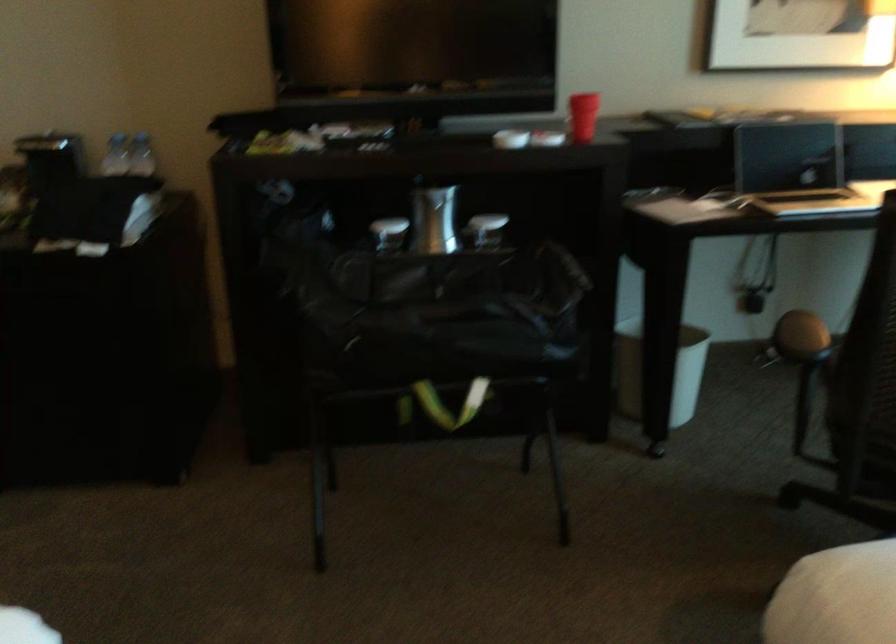
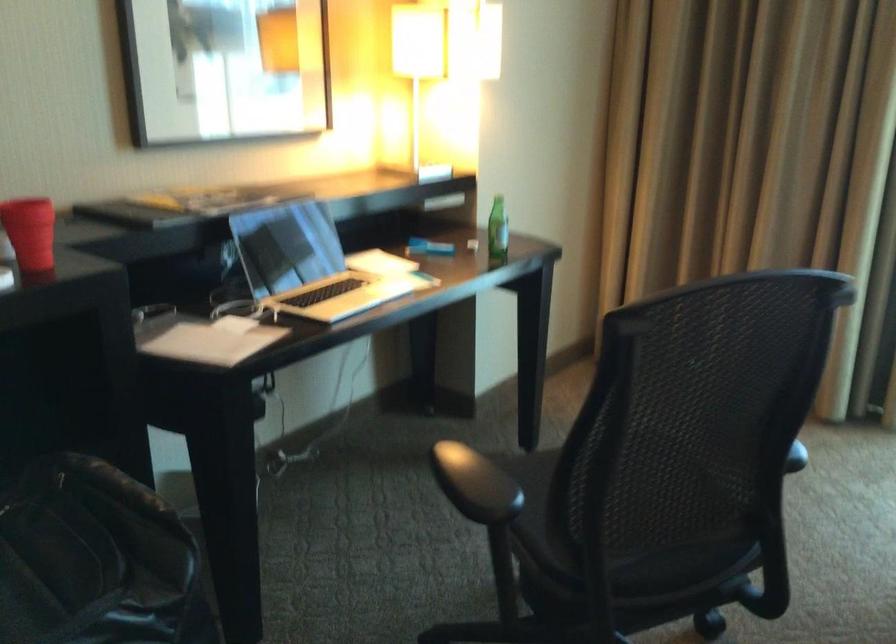
Find the pixel in the second image that matches the point at 572,114 in the first image.

(30, 232)